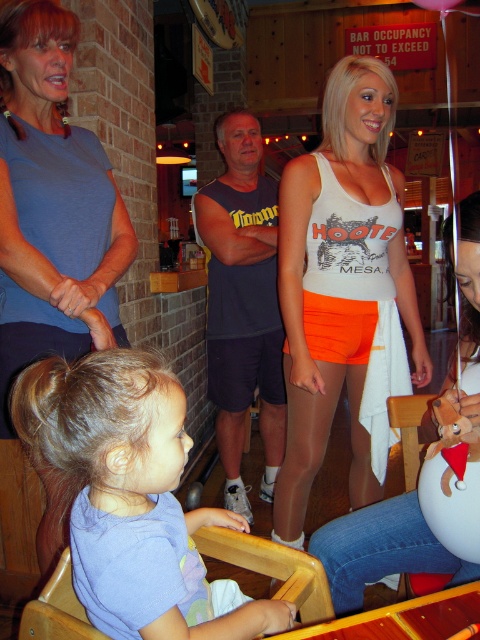
Question: Does purple cotton shirt at center have a lesser width compared to blue cotton shirt at upper left?

Choices:
 (A) no
 (B) yes

Answer: (A)

Question: Is white tank top at center smaller than white cotton tank top at center?

Choices:
 (A) yes
 (B) no

Answer: (B)

Question: Which of the following is the farthest from the observer?

Choices:
 (A) (464, 518)
 (B) (52, 52)

Answer: (B)

Question: Which of the following is the closest to the observer?

Choices:
 (A) blue cotton shirt at upper left
 (B) white cotton tank top at center
 (C) purple cotton shirt at center

Answer: (C)

Question: Can you confirm if purple cotton shirt at center is wider than blue cotton shirt at upper left?

Choices:
 (A) no
 (B) yes

Answer: (B)

Question: Estimate the real-world distances between objects in this image. Which object is closer to the white cotton tank top at center?

Choices:
 (A) blue cotton shirt at upper left
 (B) white tank top at center
 (C) purple cotton shirt at center

Answer: (C)